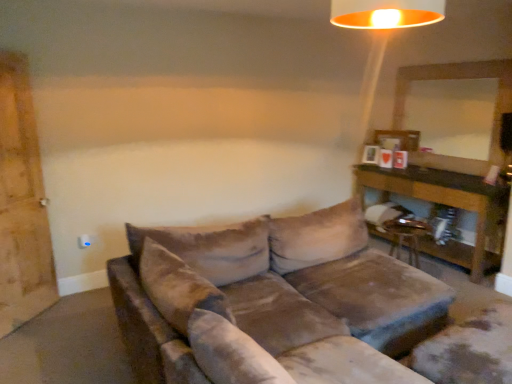
Question: Considering their positions, is metallic gold swivel chair at lower right located in front of or behind brown wooden table at right?

Choices:
 (A) front
 (B) behind

Answer: (A)

Question: Is metallic gold swivel chair at lower right taller or shorter than brown wooden table at right?

Choices:
 (A) short
 (B) tall

Answer: (A)

Question: Which object is positioned farthest from the brown wooden table at right?

Choices:
 (A) metallic gold swivel chair at lower right
 (B) velvet brown couch at center
 (C) wooden barn door at left
 (D) metallic gold lampshade at upper center

Answer: (C)

Question: Based on their relative distances, which object is farther from the metallic gold lampshade at upper center?

Choices:
 (A) brown wooden table at right
 (B) metallic gold swivel chair at lower right
 (C) wooden barn door at left
 (D) velvet brown couch at center

Answer: (C)